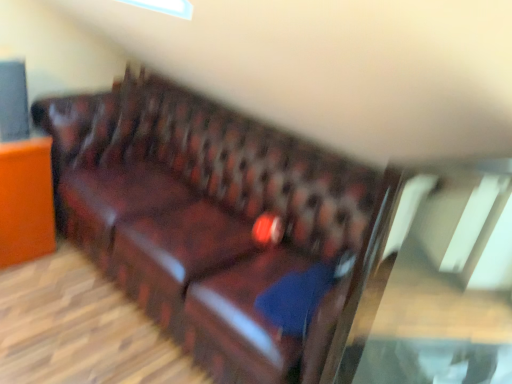
Locate an element on the screen. The width and height of the screenshot is (512, 384). matte brown leather sofa at left is located at coordinates (26, 201).

I want to click on transparent glass table at center, so click(x=432, y=281).

Is transparent glass table at center positioned with its back to blue fabric pillow at center?

Yes, blue fabric pillow at center is at the back of transparent glass table at center.

The height and width of the screenshot is (384, 512). Find the location of `pillow lying on the left of transparent glass table at center`. pillow lying on the left of transparent glass table at center is located at coordinates (296, 298).

Which object is wider, transparent glass table at center or blue fabric pillow at center?

blue fabric pillow at center is wider.

In the image, is transparent glass table at center positioned in front of or behind blue fabric pillow at center?

In the image, transparent glass table at center appears in front of blue fabric pillow at center.

Is leather couch at center positioned far away from blue fabric pillow at center?

leather couch at center is near blue fabric pillow at center, not far away.

Is point (253, 125) less distant than point (308, 289)?

No, it is not.

How many degrees apart are the facing directions of leather couch at center and blue fabric pillow at center?

0.61 degrees.

In the image, is leather couch at center positioned in front of or behind blue fabric pillow at center?

In the image, leather couch at center appears in front of blue fabric pillow at center.

Who is shorter, blue fabric pillow at center or transparent glass table at center?

blue fabric pillow at center.

Does point (297, 298) come closer to viewer compared to point (463, 312)?

That is True.

The height and width of the screenshot is (384, 512). I want to click on glass table above the blue fabric pillow at center (from a real-world perspective), so click(x=432, y=281).

Is blue fabric pillow at center further to camera compared to transparent glass table at center?

That is True.

Considering the sizes of objects blue fabric pillow at center and leather couch at center in the image provided, who is taller, blue fabric pillow at center or leather couch at center?

With more height is leather couch at center.

Is point (263, 292) less distant than point (154, 292)?

That is True.

Is blue fabric pillow at center outside of leather couch at center?

No, blue fabric pillow at center is inside or overlapping with leather couch at center.

Are blue fabric pillow at center and leather couch at center located far from each other?

Actually, blue fabric pillow at center and leather couch at center are a little close together.

Is leather couch at center positioned behind transparent glass table at center?

Yes, leather couch at center is further from the camera.

Can you tell me how much leather couch at center and transparent glass table at center differ in facing direction?

68.4 degrees separate the facing orientations of leather couch at center and transparent glass table at center.

Considering the relative sizes of leather couch at center and transparent glass table at center in the image provided, is leather couch at center wider than transparent glass table at center?

Yes.

Based on the photo, which object is further away from the camera taking this photo, matte brown leather sofa at left or transparent glass table at center?

Positioned behind is matte brown leather sofa at left.

Is matte brown leather sofa at left directly adjacent to transparent glass table at center?

matte brown leather sofa at left is not next to transparent glass table at center, and they're not touching.

Considering the relative sizes of matte brown leather sofa at left and transparent glass table at center in the image provided, is matte brown leather sofa at left bigger than transparent glass table at center?

Yes.

Who is taller, matte brown leather sofa at left or transparent glass table at center?

With more height is transparent glass table at center.

How different are the orientations of transparent glass table at center and leather couch at center in degrees?

There is a 68.4-degree angle between the facing directions of transparent glass table at center and leather couch at center.

Is transparent glass table at center with leather couch at center?

No, transparent glass table at center is not next to leather couch at center.

Considering the relative sizes of transparent glass table at center and leather couch at center in the image provided, is transparent glass table at center bigger than leather couch at center?

Actually, transparent glass table at center might be smaller than leather couch at center.

Which object is positioned more to the left, transparent glass table at center or leather couch at center?

From the viewer's perspective, leather couch at center appears more on the left side.

Image resolution: width=512 pixels, height=384 pixels. I want to click on glass table in front of the blue fabric pillow at center, so click(432, 281).

Locate an element on the screen. This screenshot has height=384, width=512. studio couch on the left of the blue fabric pillow at center is located at coordinates (205, 217).

From the image, which object appears to be farther from transparent glass table at center, matte brown leather sofa at left or leather couch at center?

matte brown leather sofa at left is positioned further to the anchor transparent glass table at center.

Based on their spatial positions, is blue fabric pillow at center or leather couch at center closer to matte brown leather sofa at left?

leather couch at center lies closer to matte brown leather sofa at left than the other object.

From the image, which object appears to be nearer to matte brown leather sofa at left, leather couch at center or transparent glass table at center?

Among the two, leather couch at center is located nearer to matte brown leather sofa at left.

Based on their spatial positions, is blue fabric pillow at center or leather couch at center further from transparent glass table at center?

Among the two, leather couch at center is located further to transparent glass table at center.

Looking at the image, which one is located closer to matte brown leather sofa at left, transparent glass table at center or leather couch at center?

The object closer to matte brown leather sofa at left is leather couch at center.

Estimate the real-world distances between objects in this image. Which object is closer to transparent glass table at center, leather couch at center or blue fabric pillow at center?

Based on the image, blue fabric pillow at center appears to be nearer to transparent glass table at center.

When comparing their distances from matte brown leather sofa at left, does leather couch at center or blue fabric pillow at center seem further?

blue fabric pillow at center is positioned further to the anchor matte brown leather sofa at left.

When comparing their distances from blue fabric pillow at center, does leather couch at center or matte brown leather sofa at left seem closer?

Based on the image, leather couch at center appears to be nearer to blue fabric pillow at center.

Where is `studio couch situated between matte brown leather sofa at left and transparent glass table at center from left to right`? studio couch situated between matte brown leather sofa at left and transparent glass table at center from left to right is located at coordinates (205, 217).

Find the location of a particular element. The image size is (512, 384). studio couch between transparent glass table at center and blue fabric pillow at center from front to back is located at coordinates (205, 217).

The height and width of the screenshot is (384, 512). I want to click on pillow between matte brown leather sofa at left and transparent glass table at center in the horizontal direction, so click(x=296, y=298).

Find the location of a particular element. Image resolution: width=512 pixels, height=384 pixels. studio couch located between matte brown leather sofa at left and blue fabric pillow at center in the left-right direction is located at coordinates (205, 217).